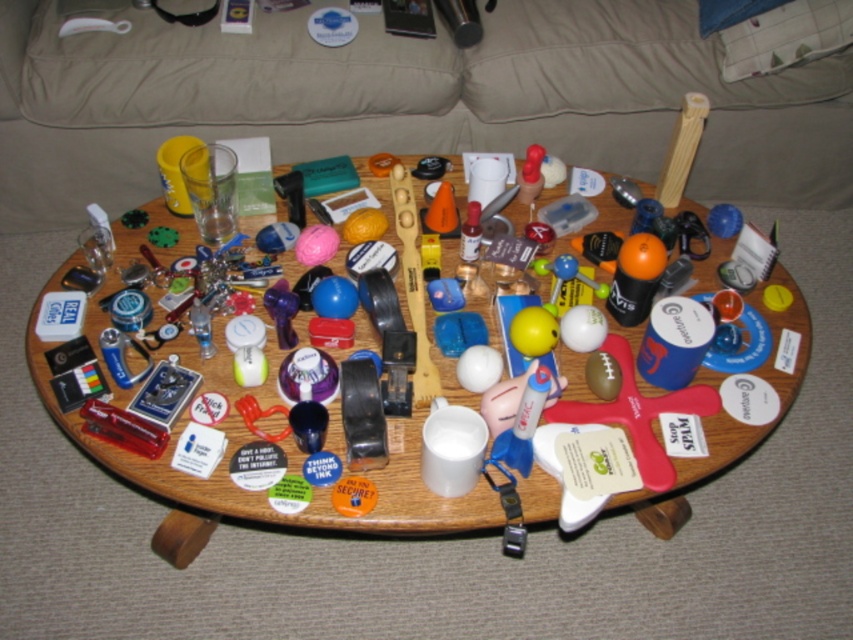
Consider the image. You are standing in front of the coffee table and want to pick up an item located at point (30, 170). If your hand can reach up to 1.5 meters, can you reach it?

The distance of point (30, 170) from the camera is 1.68 meters, so your hand cannot reach it since it is farther than 1.5 meters.

You are a guest in a living room and want to sit on the beige fabric couch at upper center. To reach it, you need to walk around the wooden table at center. Is the couch lower than the table?

The beige fabric couch at upper center is not as tall as the wooden table at center, so yes, the couch is lower than the table.